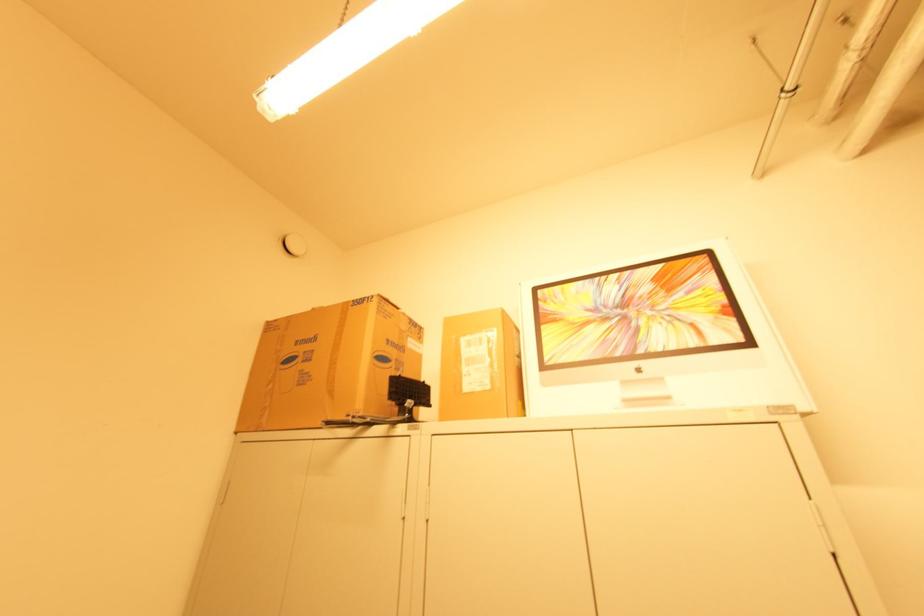
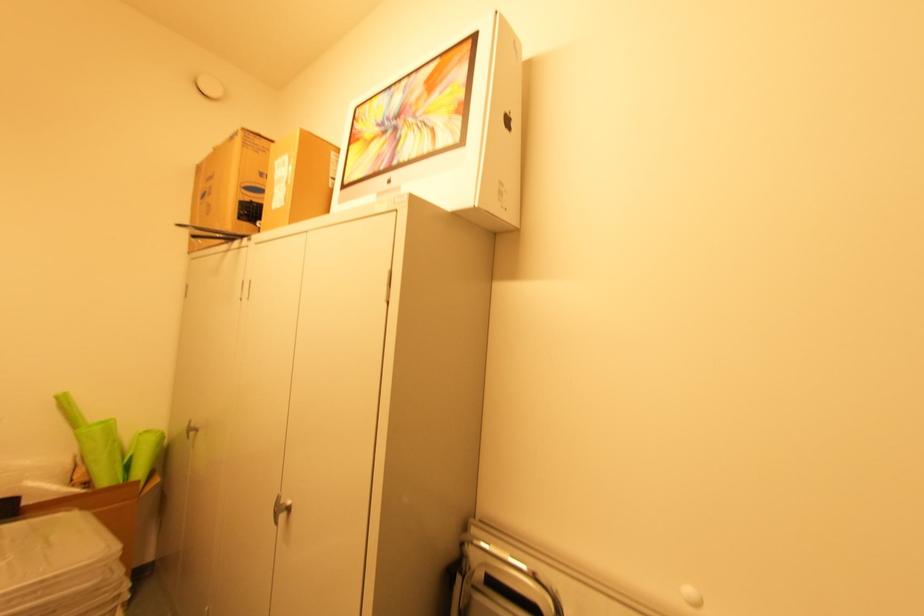
The point at (315, 309) is marked in the first image. Where is the corresponding point in the second image?

(216, 148)